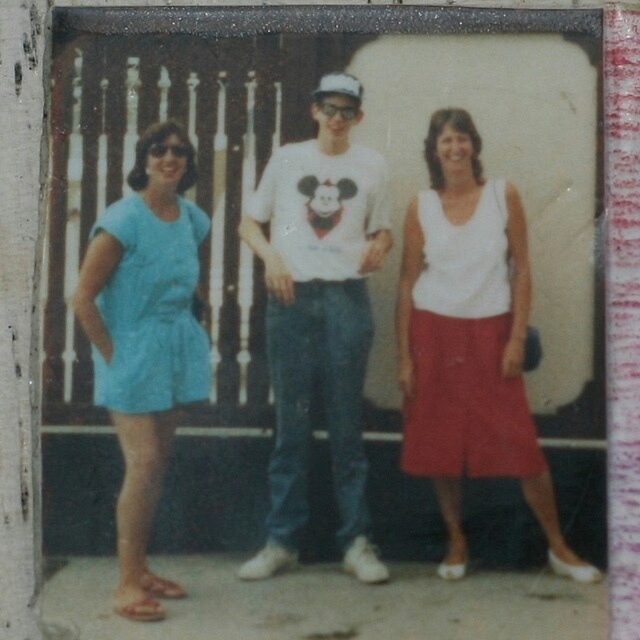
From the picture: Between white matte tank top at center and white cotton t-shirt at center, which one is positioned lower?

white matte tank top at center is lower down.

Which is in front, point (483, 388) or point (339, 483)?

Point (339, 483) is in front.

Measure the distance between point (481,465) and camera.

Point (481,465) is 32.94 inches from camera.

This screenshot has height=640, width=640. Find the location of `white matte tank top at center`. white matte tank top at center is located at coordinates (468, 340).

Is white cotton t-shirt at center to the right of light blue fabric dress at left from the viewer's perspective?

Yes, white cotton t-shirt at center is to the right of light blue fabric dress at left.

Does white cotton t-shirt at center have a lesser height compared to light blue fabric dress at left?

No.

Between point (344, 163) and point (134, 556), which one is positioned behind?

The point (344, 163) is behind.

This screenshot has height=640, width=640. I want to click on white cotton t-shirt at center, so pos(317,317).

Between white matte tank top at center and light blue fabric dress at left, which one appears on the right side from the viewer's perspective?

A: From the viewer's perspective, white matte tank top at center appears more on the right side.

Is point (496, 467) positioned behind point (96, 376)?

No, (496, 467) is closer to viewer.

I want to click on white matte tank top at center, so click(468, 340).